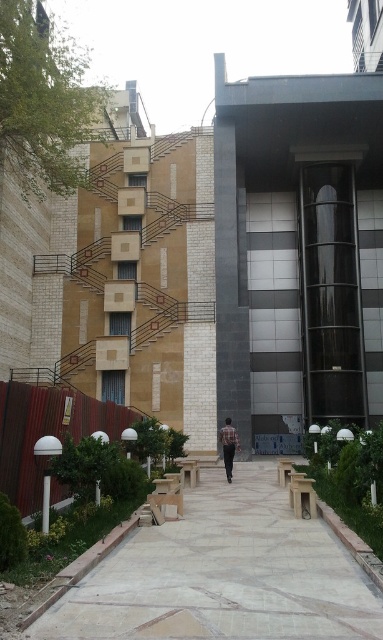
Which is behind, point (278, 620) or point (224, 460)?

The point (224, 460) is behind.

Looking at this image, does light gray concrete pavement at center have a lesser width compared to brown plaid shirt at center?

In fact, light gray concrete pavement at center might be wider than brown plaid shirt at center.

Between point (183, 637) and point (230, 474), which one is positioned behind?

The point (230, 474) is behind.

Where is `light gray concrete pavement at center`? Image resolution: width=383 pixels, height=640 pixels. light gray concrete pavement at center is located at coordinates (222, 573).